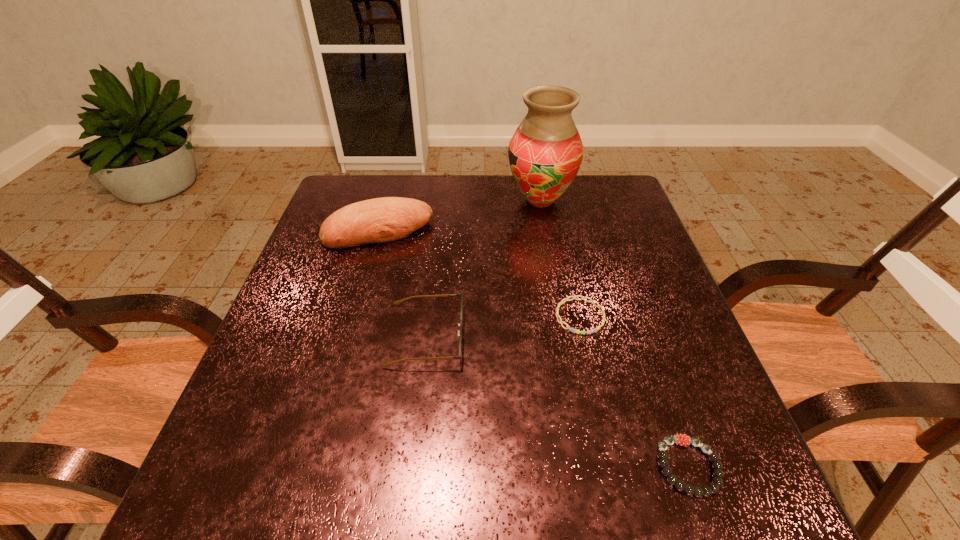
Find the location of a particular element. The image size is (960, 540). unoccupied area between the tallest object and the third shortest object is located at coordinates (483, 268).

This screenshot has width=960, height=540. Identify the location of free space between the left bracelet and the spectacles. click(x=503, y=326).

Locate which object is the second closest to the spectacles. Please provide its 2D coordinates. Your answer should be formatted as a tuple, i.e. [(x, y)], where the tuple contains the x and y coordinates of a point satisfying the conditions above.

[(561, 322)]

Select which object is the closest to the farther bracelet. Please provide its 2D coordinates. Your answer should be formatted as a tuple, i.e. [(x, y)], where the tuple contains the x and y coordinates of a point satisfying the conditions above.

[(461, 294)]

Find the location of a particular element. This screenshot has height=540, width=960. vacant space that satisfies the following two spatial constraints: 1. on the front-facing side of the nearer bracelet; 2. on the right side of the third shortest object is located at coordinates (411, 467).

Locate an element on the screen. free space that satisfies the following two spatial constraints: 1. on the front side of the tallest object; 2. on the right side of the nearer bracelet is located at coordinates (588, 467).